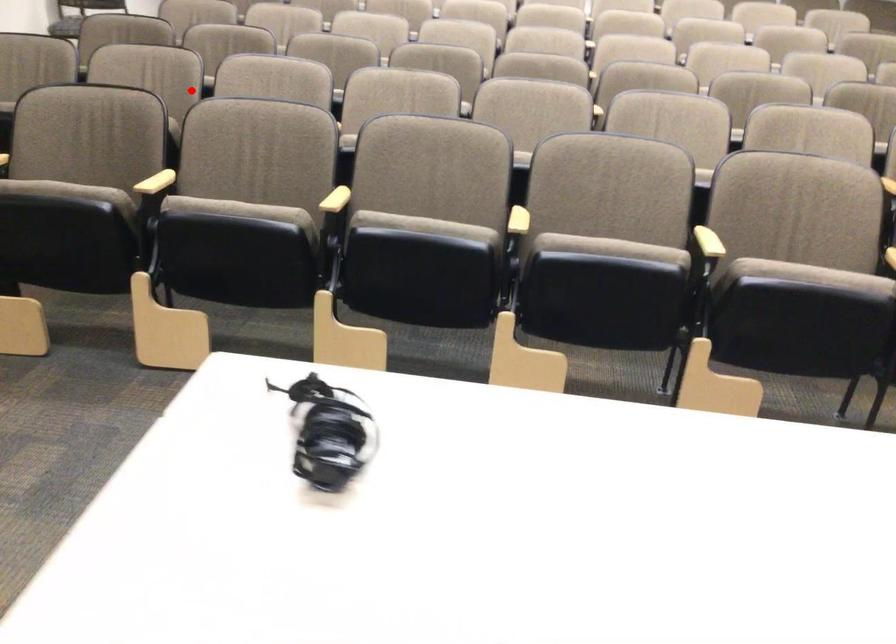
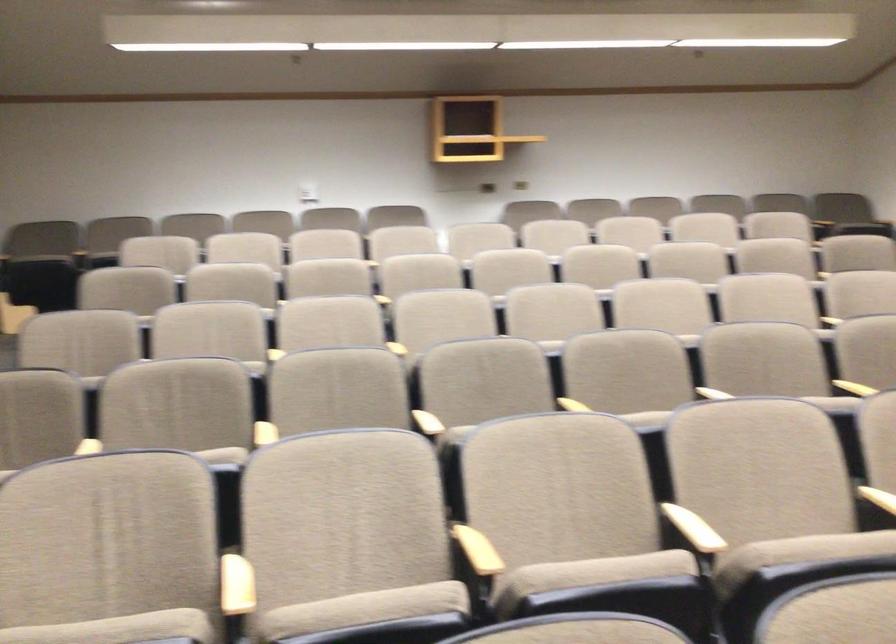
Question: I am providing you with two images of the same scene from different viewpoints. In image1, a red point is highlighted. Considering the same 3D point in image2, which of the following is correct?

Choices:
 (A) It is closer
 (B) It is farther

Answer: (A)